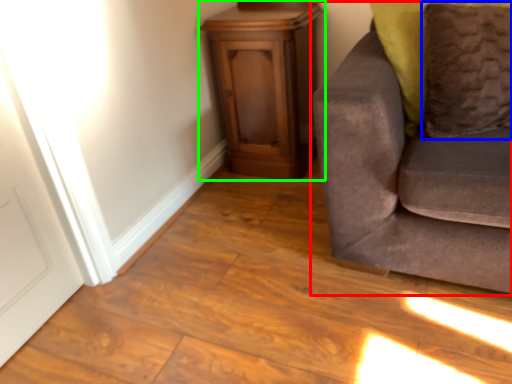
Question: Which object is the closest to the studio couch (highlighted by a red box)? Choose among these: pillow (highlighted by a blue box) or furniture (highlighted by a green box).

Choices:
 (A) pillow
 (B) furniture

Answer: (A)